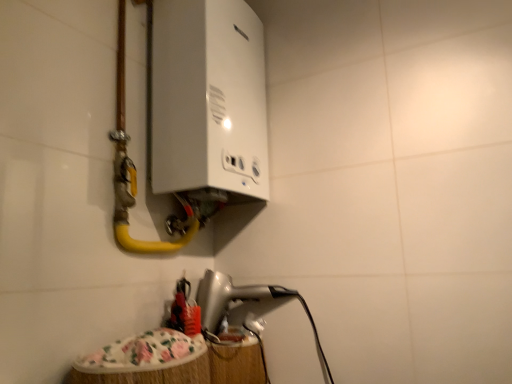
Question: From the image's perspective, is yellow rubber hose at upper left located above or below silver metallic hairdryer at lower center, which appears as the second appliance when viewed from the top?

Choices:
 (A) below
 (B) above

Answer: (B)

Question: Relative to silver metallic hairdryer at lower center, which appears as the second appliance when viewed from the top, is yellow rubber hose at upper left in front or behind?

Choices:
 (A) front
 (B) behind

Answer: (A)

Question: Which object is the closest to the silver metallic hairdryer at lower center, which is the first appliance in bottom-to-top order?

Choices:
 (A) yellow rubber hose at upper left
 (B) white glossy boiler at upper center, the 2th appliance in the bottom-to-top sequence

Answer: (A)

Question: Which object is the closest to the yellow rubber hose at upper left?

Choices:
 (A) silver metallic hairdryer at lower center, which is the first appliance in bottom-to-top order
 (B) white glossy boiler at upper center, the 2th appliance in the bottom-to-top sequence

Answer: (B)